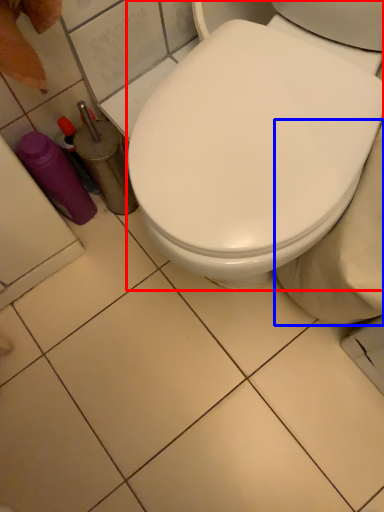
Question: Which of the following is the closest to the observer, toilet (highlighted by a red box) or bidet (highlighted by a blue box)?

Choices:
 (A) toilet
 (B) bidet

Answer: (A)